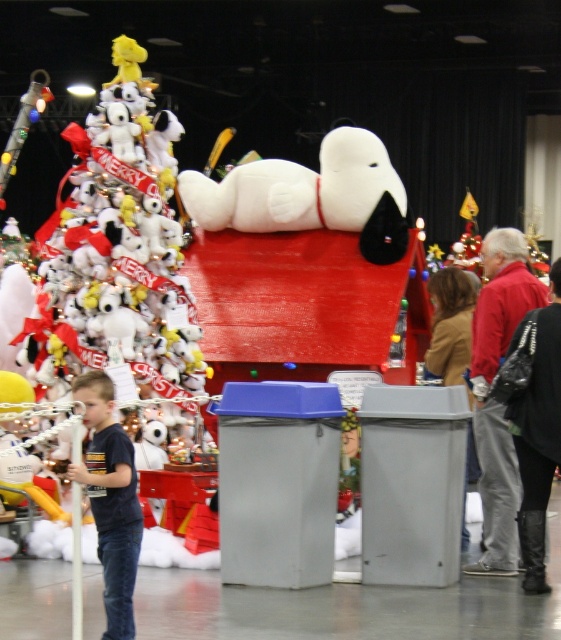
Between white plush dog at center and red leather jacket at right, which one appears on the right side from the viewer's perspective?

red leather jacket at right is more to the right.

Which is in front, point (387, 164) or point (542, 298)?

Point (542, 298) is in front.

Find the location of a particular element. This screenshot has width=561, height=640. white plush dog at center is located at coordinates (310, 195).

Who is positioned more to the right, black leather boots at lower right or brown leather jacket at center?

black leather boots at lower right is more to the right.

Is black leather boots at lower right below brown leather jacket at center?

Indeed, black leather boots at lower right is positioned under brown leather jacket at center.

Who is more forward, (x=523, y=428) or (x=457, y=332)?

Point (x=523, y=428)

This screenshot has height=640, width=561. Identify the location of black leather boots at lower right. (537, 433).

Does white plush snoopy at upper center appear under white plush dog at center?

Correct, white plush snoopy at upper center is located below white plush dog at center.

Is point (113, 326) closer to viewer compared to point (269, 202)?

Yes, point (113, 326) is closer to viewer.

You are a GUI agent. You are given a task and a screenshot of the screen. Output one action in this format:
    pyautogui.click(x=<x>, y=<y>)
    Task: Click on the white plush snoopy at upper center
    Image resolution: width=561 pixels, height=640 pixels.
    Given the screenshot: What is the action you would take?
    pyautogui.click(x=119, y=269)